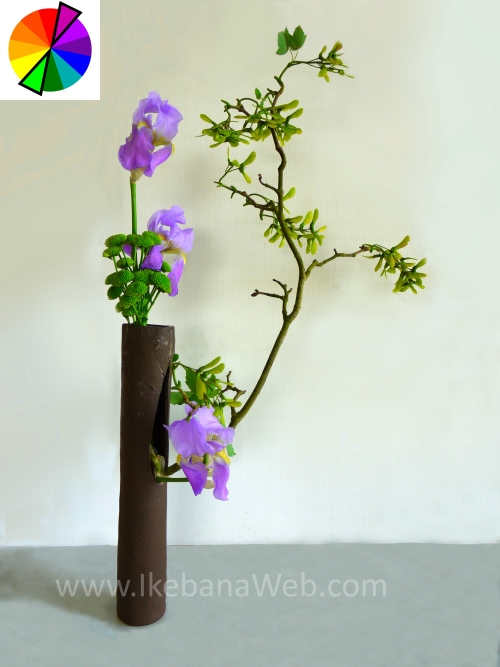
Where is `vase opening`? This screenshot has width=500, height=667. vase opening is located at coordinates (156, 325), (164, 441).